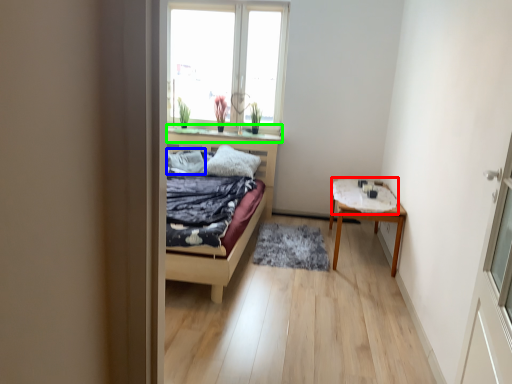
Question: Which is farther away from sheet (highlighted by a red box)? pillow (highlighted by a blue box) or window sill (highlighted by a green box)?

Choices:
 (A) pillow
 (B) window sill

Answer: (A)